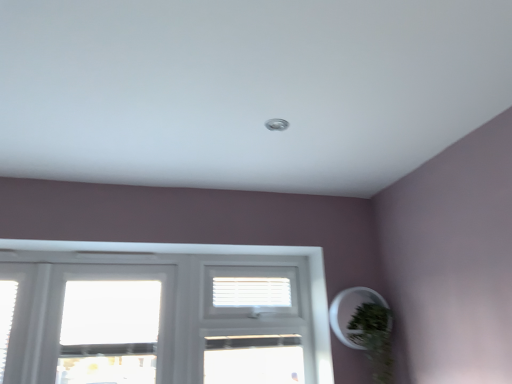
The image size is (512, 384). Describe the element at coordinates (256, 324) in the screenshot. I see `white plastic screen door at center` at that location.

The image size is (512, 384). What do you see at coordinates (374, 339) in the screenshot?
I see `green matte plant at lower right` at bounding box center [374, 339].

Locate an element on the screen. white plastic blinds at center is located at coordinates (252, 292).

Where is `white plastic screen door at center`? Image resolution: width=512 pixels, height=384 pixels. white plastic screen door at center is located at coordinates (256, 324).

Is white plastic blinds at center with white plastic screen door at center?

No, white plastic blinds at center is not next to white plastic screen door at center.

Does white plastic blinds at center have a lesser height compared to white plastic screen door at center?

Correct, white plastic blinds at center is not as tall as white plastic screen door at center.

How many degrees apart are the facing directions of white plastic blinds at center and white plastic screen door at center?

The facing directions of white plastic blinds at center and white plastic screen door at center are 1.05 degrees apart.

Can you confirm if white plastic blinds at center is positioned to the right of white plastic screen door at center?

Correct, you'll find white plastic blinds at center to the right of white plastic screen door at center.

Can you confirm if white plastic screen door at center is thinner than green matte plant at lower right?

Indeed, white plastic screen door at center has a lesser width compared to green matte plant at lower right.

Would you say white plastic screen door at center contains green matte plant at lower right?

No, green matte plant at lower right is not inside white plastic screen door at center.

Is white plastic screen door at center next to green matte plant at lower right and touching it?

white plastic screen door at center is not next to green matte plant at lower right, and they're not touching.

Considering the relative positions of white plastic screen door at center and green matte plant at lower right in the image provided, is white plastic screen door at center to the right of green matte plant at lower right from the viewer's perspective?

In fact, white plastic screen door at center is to the left of green matte plant at lower right.

From a real-world perspective, is green matte plant at lower right over white plastic screen door at center?

Incorrect, from a real-world perspective, green matte plant at lower right is lower than white plastic screen door at center.

Is point (378, 314) positioned after point (205, 359)?

No, (378, 314) is in front of (205, 359).

Based on the photo, from the image's perspective, does green matte plant at lower right appear higher than white plastic screen door at center?

No, from the image's perspective, green matte plant at lower right is not on top of white plastic screen door at center.

Between point (361, 332) and point (218, 302), which one is positioned behind?

The point (218, 302) is more distant.

Is green matte plant at lower right wider than white plastic blinds at center?

Indeed, green matte plant at lower right has a greater width compared to white plastic blinds at center.

Is green matte plant at lower right oriented away from white plastic blinds at center?

That's not correct — green matte plant at lower right is not looking away from white plastic blinds at center.

Is the depth of green matte plant at lower right greater than that of white plastic blinds at center?

No, it is in front of white plastic blinds at center.

Is white plastic blinds at center placed right next to green matte plant at lower right?

There is a gap between white plastic blinds at center and green matte plant at lower right.

Does white plastic blinds at center lie behind green matte plant at lower right?

Yes, white plastic blinds at center is further from the viewer.

Does point (294, 283) come closer to viewer compared to point (374, 304)?

No, it is behind (374, 304).

From the image's perspective, is white plastic blinds at center over green matte plant at lower right?

Yes.

Which is correct: white plastic screen door at center is inside white plastic blinds at center, or outside of it?

white plastic screen door at center cannot be found inside white plastic blinds at center.

Considering the relative sizes of white plastic screen door at center and white plastic blinds at center in the image provided, is white plastic screen door at center shorter than white plastic blinds at center?

Incorrect, the height of white plastic screen door at center does not fall short of that of white plastic blinds at center.

In the scene shown: Is white plastic screen door at center at the right side of white plastic blinds at center?

Incorrect, white plastic screen door at center is not on the right side of white plastic blinds at center.

Is point (311, 353) less distant than point (233, 301)?

Yes, point (311, 353) is in front of point (233, 301).

The image size is (512, 384). What are the coordinates of `blind above the white plastic screen door at center (from a real-world perspective)` in the screenshot? It's located at (252, 292).

Where is `screen door behind the green matte plant at lower right`? The width and height of the screenshot is (512, 384). screen door behind the green matte plant at lower right is located at coordinates (256, 324).

Based on their spatial positions, is white plastic blinds at center or green matte plant at lower right further from white plastic screen door at center?

green matte plant at lower right.

Looking at the image, which one is located closer to green matte plant at lower right, white plastic blinds at center or white plastic screen door at center?

white plastic screen door at center lies closer to green matte plant at lower right than the other object.

Considering their positions, is green matte plant at lower right positioned further to white plastic blinds at center than white plastic screen door at center?

Among the two, green matte plant at lower right is located further to white plastic blinds at center.

Considering their positions, is white plastic screen door at center positioned closer to green matte plant at lower right than white plastic blinds at center?

white plastic screen door at center lies closer to green matte plant at lower right than the other object.

When comparing their distances from white plastic screen door at center, does green matte plant at lower right or white plastic blinds at center seem closer?

white plastic blinds at center lies closer to white plastic screen door at center than the other object.

Estimate the real-world distances between objects in this image. Which object is further from white plastic blinds at center, white plastic screen door at center or green matte plant at lower right?

Among the two, green matte plant at lower right is located further to white plastic blinds at center.

The height and width of the screenshot is (384, 512). I want to click on blind located between white plastic screen door at center and green matte plant at lower right in the left-right direction, so click(x=252, y=292).